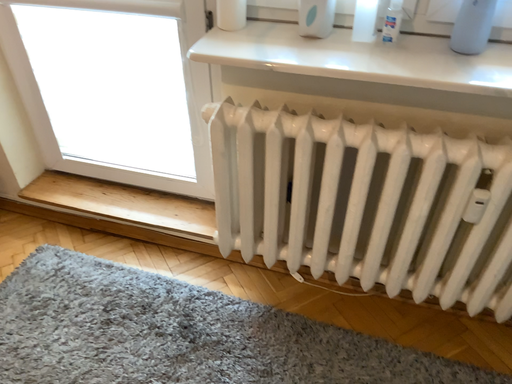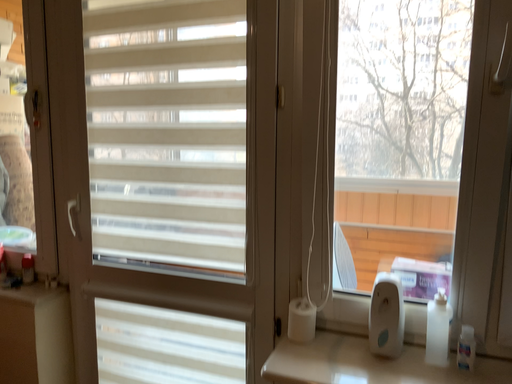
Question: Which way did the camera rotate in the video?

Choices:
 (A) rotated upward
 (B) rotated downward

Answer: (A)